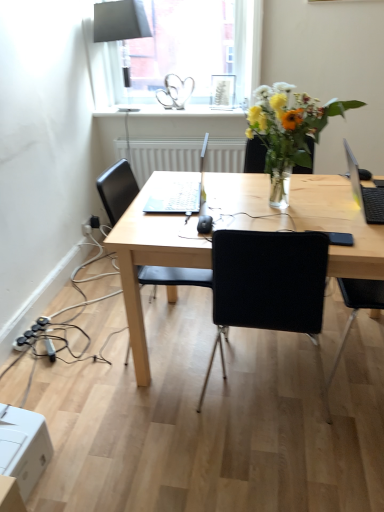
Where is `vacant space situated above light wood desk at center (from a real-world perspective)`? vacant space situated above light wood desk at center (from a real-world perspective) is located at coordinates tap(254, 196).